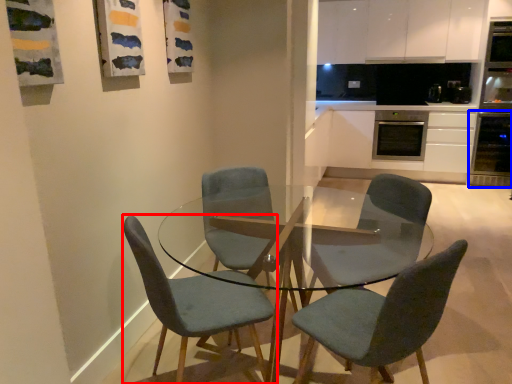
Question: Which of the following is the farthest to the observer, chair (highlighted by a red box) or oven (highlighted by a blue box)?

Choices:
 (A) chair
 (B) oven

Answer: (B)